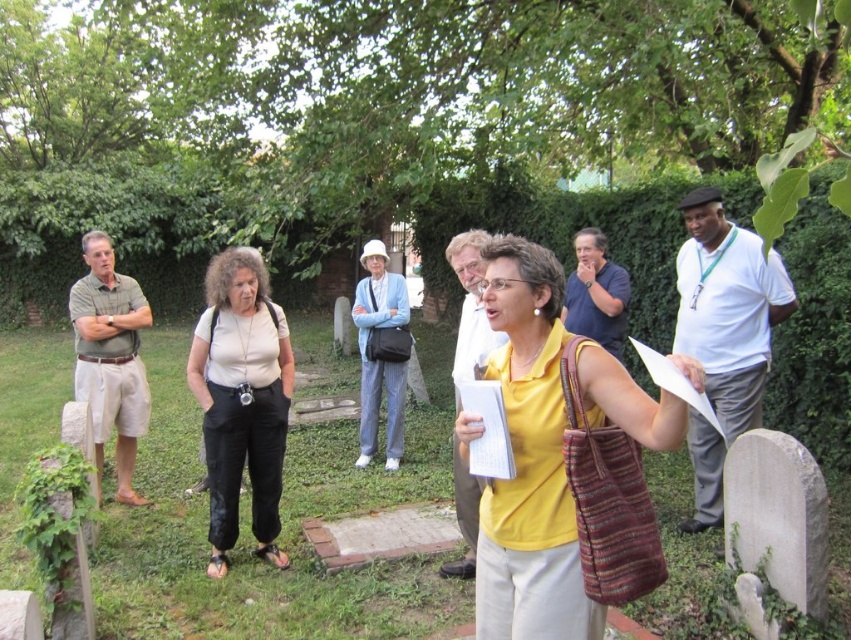
Question: Is white cotton shirt at center bigger than blue cotton shirt at upper center?

Choices:
 (A) yes
 (B) no

Answer: (A)

Question: Based on their relative distances, which object is nearer to the blue cotton shirt at upper center?

Choices:
 (A) green cotton shirt at left
 (B) matte white shirt at center
 (C) yellow fabric shirt at center

Answer: (B)

Question: Is light blue striped pants at center bigger than blue cotton shirt at upper center?

Choices:
 (A) yes
 (B) no

Answer: (A)

Question: Does light blue striped pants at center lie behind blue cotton shirt at upper center?

Choices:
 (A) no
 (B) yes

Answer: (B)

Question: Which object appears farthest from the camera in this image?

Choices:
 (A) blue cotton shirt at upper center
 (B) green cotton shirt at left

Answer: (A)

Question: Among these objects, which one is nearest to the camera?

Choices:
 (A) matte white shirt at center
 (B) yellow fabric shirt at center
 (C) white cotton shirt at center
 (D) green cotton shirt at left

Answer: (B)